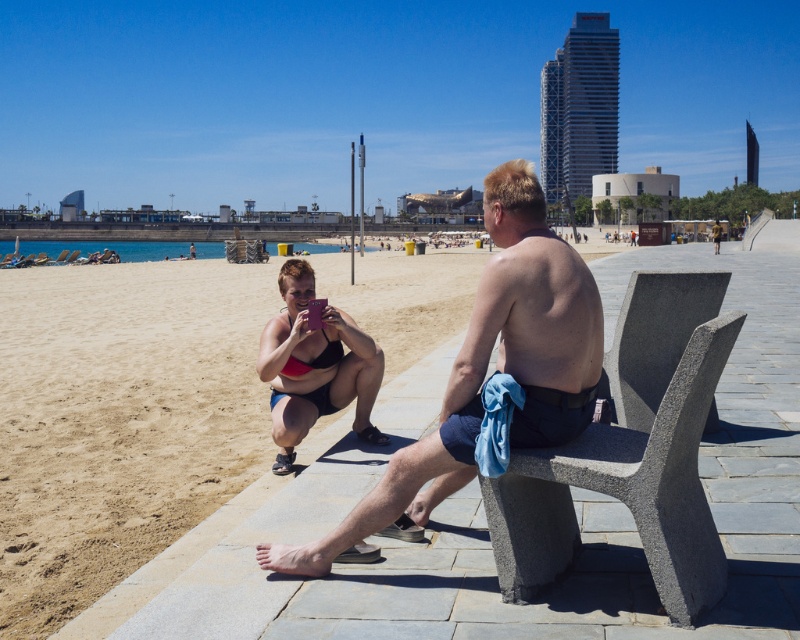
Question: Which object is farther from the camera taking this photo?

Choices:
 (A) matte pink bikini at center
 (B) smooth skin man at center
 (C) sandy beach at lower left

Answer: (A)

Question: Does sandy beach at lower left appear over smooth skin man at center?

Choices:
 (A) yes
 (B) no

Answer: (A)

Question: Can you confirm if sandy beach at lower left is smaller than matte pink bikini at center?

Choices:
 (A) no
 (B) yes

Answer: (A)

Question: Observing the image, what is the correct spatial positioning of sandy beach at lower left in reference to matte pink bikini at center?

Choices:
 (A) left
 (B) right

Answer: (B)

Question: Estimate the real-world distances between objects in this image. Which object is closer to the sandy beach at lower left?

Choices:
 (A) smooth skin man at center
 (B) matte pink bikini at center
 (C) gray concrete bench at right

Answer: (B)

Question: Which point is closer to the camera taking this photo?

Choices:
 (A) (522, 342)
 (B) (348, 400)
 (C) (780, 602)

Answer: (C)